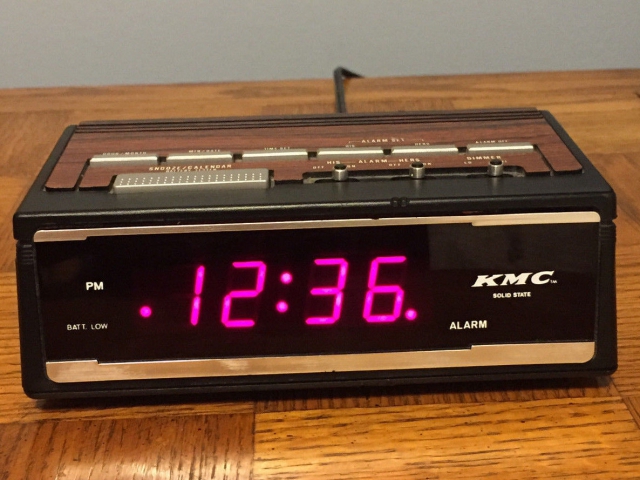
In order to click on top of clock in this screenshot , I will do `click(300, 136)`.